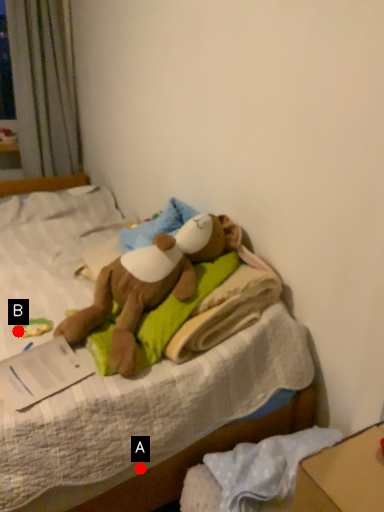
Question: Two points are circled on the image, labeled by A and B beside each circle. Which point is further to the camera?

Choices:
 (A) A is further
 (B) B is further

Answer: (B)